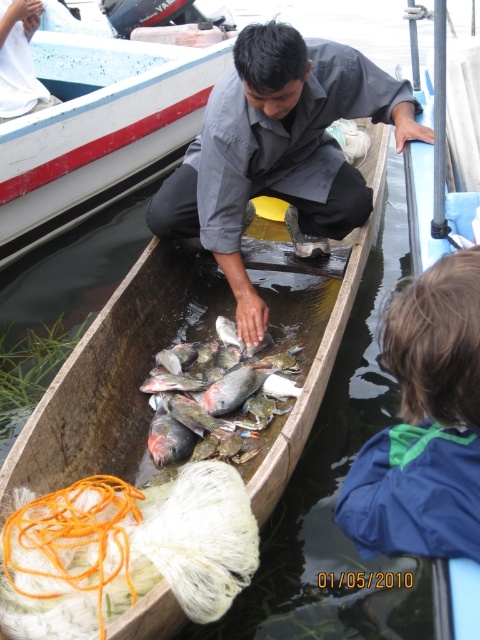
Question: Does blue fleece jacket at lower right have a lesser width compared to shiny silver fish at center?

Choices:
 (A) yes
 (B) no

Answer: (A)

Question: Can you confirm if blue fleece jacket at lower right is positioned below shiny silver fish at center?

Choices:
 (A) no
 (B) yes

Answer: (A)

Question: Which object appears closest to the camera in this image?

Choices:
 (A) shiny metallic fish at center
 (B) gray fabric shirt at center
 (C) shiny pinkish-red fish at center
 (D) wooden boat at center

Answer: (B)

Question: Which object is closer to the camera taking this photo?

Choices:
 (A) shiny silver fish at center
 (B) wooden boat at center
 (C) blue fleece jacket at lower right

Answer: (C)

Question: Does wooden boat at center have a greater width compared to shiny pinkish-red fish at center?

Choices:
 (A) yes
 (B) no

Answer: (A)

Question: Which point is farther from the camera taking this photo?

Choices:
 (A) (245, 426)
 (B) (184, 458)
 (C) (409, 99)
 (D) (245, 371)

Answer: (C)